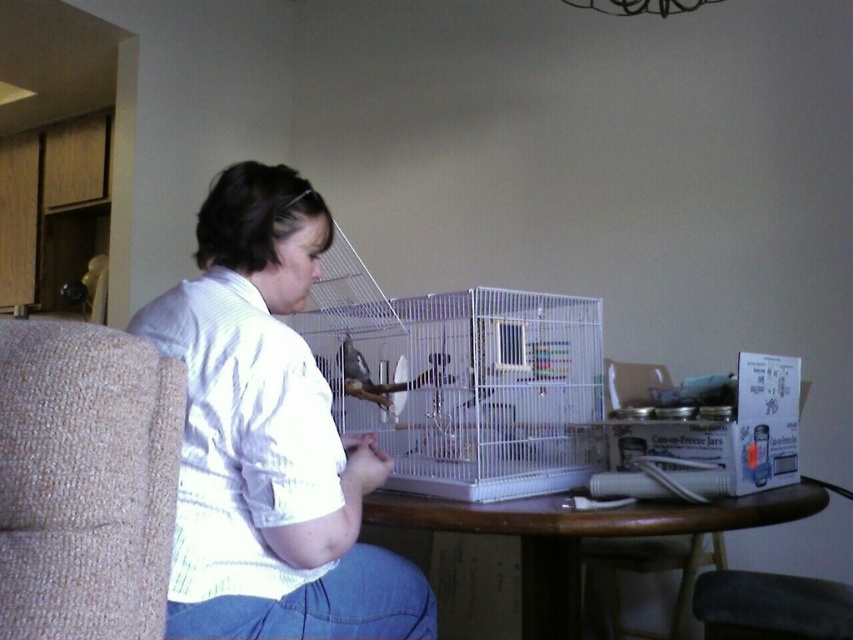
Question: Observing the image, what is the correct spatial positioning of white wire bird cage at center in reference to beige textured armchair at left?

Choices:
 (A) below
 (B) above

Answer: (B)

Question: Is white wire bird cage at center positioned before matte white bird at center?

Choices:
 (A) yes
 (B) no

Answer: (A)

Question: Is wooden table at center bigger than matte white bird at center?

Choices:
 (A) no
 (B) yes

Answer: (B)

Question: Considering the real-world distances, which object is closest to the white wire bird cage at center?

Choices:
 (A) wooden table at center
 (B) velvet-like dark brown chair at lower right
 (C) white striped shirt at center
 (D) matte white bird at center

Answer: (D)

Question: Estimate the real-world distances between objects in this image. Which object is closer to the white wire bird cage at center?

Choices:
 (A) clear plastic chair at lower right
 (B) velvet-like dark brown chair at lower right
 (C) wooden table at center

Answer: (C)

Question: Based on their relative distances, which object is farther from the wooden table at center?

Choices:
 (A) matte white bird at center
 (B) white striped shirt at center

Answer: (A)